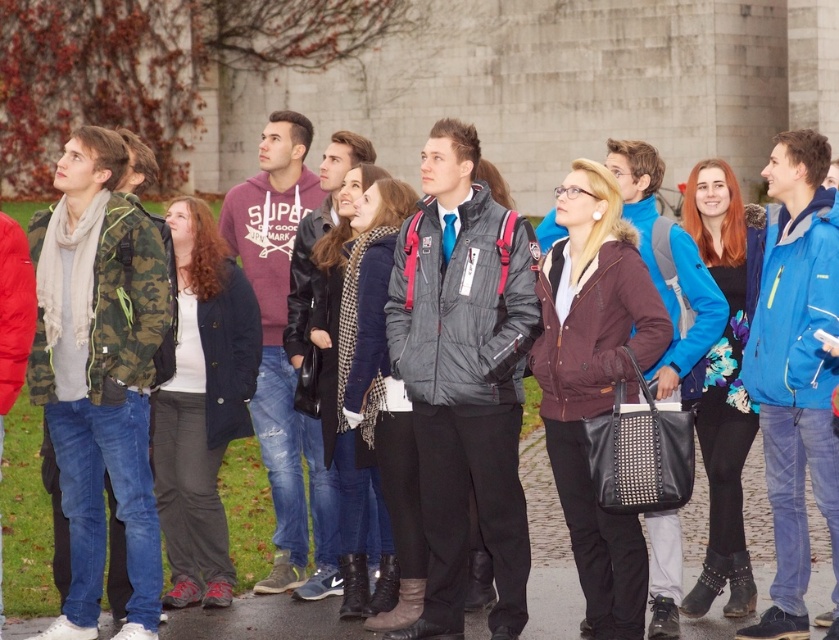
Question: Is burgundy leather jacket at center thinner than floral-patterned top at center?

Choices:
 (A) no
 (B) yes

Answer: (A)

Question: Which point is farther to the camera?

Choices:
 (A) floral-patterned top at center
 (B) burgundy leather jacket at center
 (C) dark blue cotton jacket at center

Answer: (C)

Question: Can you confirm if burgundy leather jacket at center is wider than dark blue cotton jacket at center?

Choices:
 (A) no
 (B) yes

Answer: (B)

Question: Does burgundy leather jacket at center appear on the left side of dark blue cotton jacket at center?

Choices:
 (A) yes
 (B) no

Answer: (B)

Question: Which object is positioned closest to the dark blue cotton jacket at center?

Choices:
 (A) burgundy leather jacket at center
 (B) floral-patterned top at center

Answer: (A)

Question: Which point is farther to the camera?

Choices:
 (A) (702, 193)
 (B) (249, 342)
 (C) (598, 241)

Answer: (A)